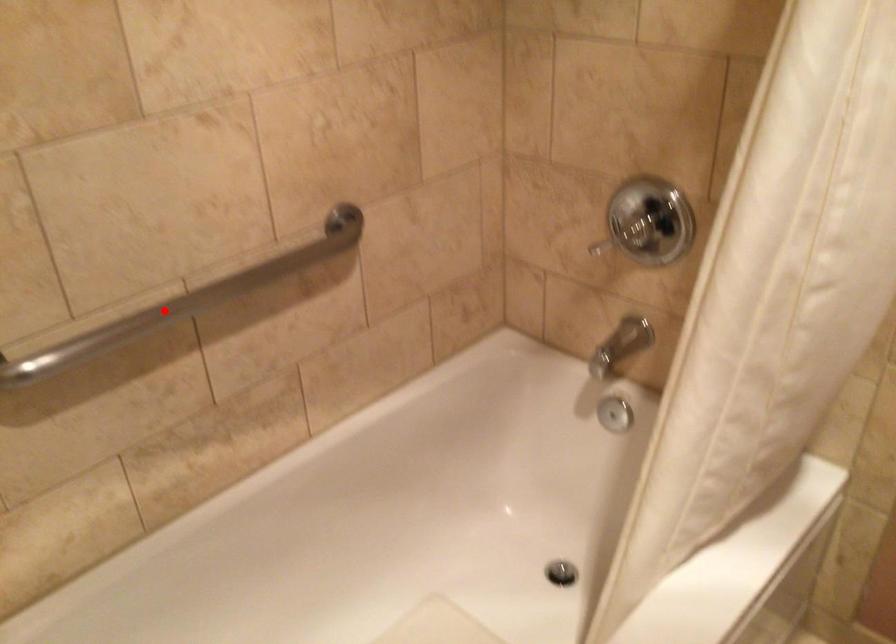
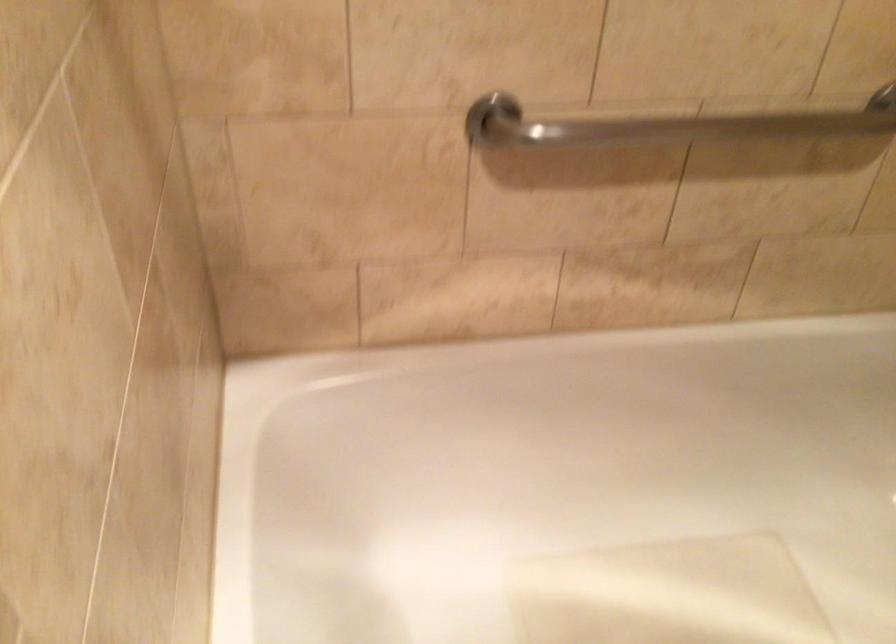
Find the pixel in the second image that matches the highlighted location in the first image.

(668, 124)